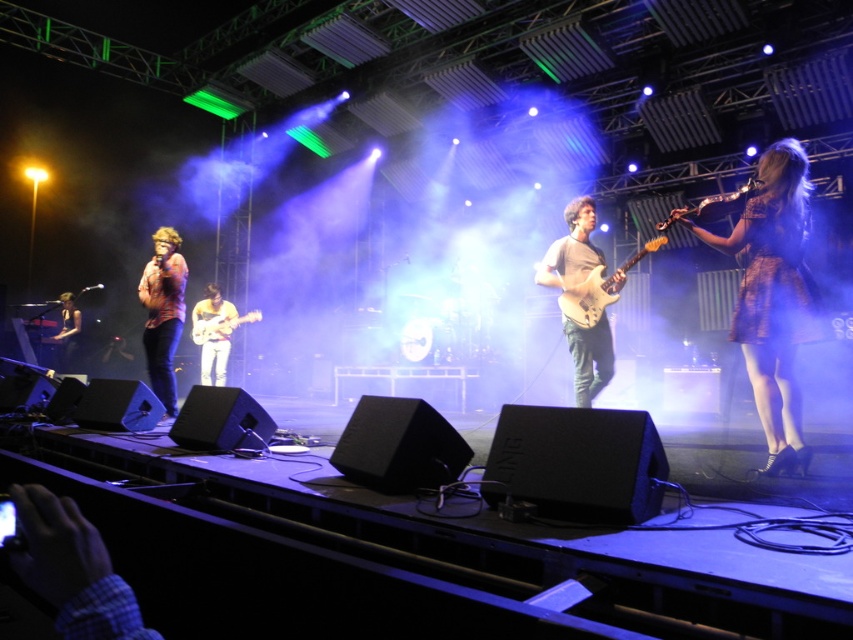
Question: Which point appears closest to the camera in this image?

Choices:
 (A) (714, 204)
 (B) (206, 307)
 (C) (229, 308)
 (D) (795, 164)

Answer: (D)

Question: Can you confirm if matte gray guitar at center is positioned below shiny silver guitar at right?

Choices:
 (A) no
 (B) yes

Answer: (B)

Question: Does patterned fabric dress at right appear on the left side of matte black guitar at left?

Choices:
 (A) no
 (B) yes

Answer: (A)

Question: Is light brown leather guitar at center smaller than matte white electric guitar at center?

Choices:
 (A) no
 (B) yes

Answer: (A)

Question: Which of these objects is positioned farthest from the shiny silver guitar at center?

Choices:
 (A) light brown leather guitar at center
 (B) shiny silver guitar at right
 (C) striped shirt at center
 (D) patterned fabric dress at right

Answer: (D)

Question: Which object appears closest to the camera in this image?

Choices:
 (A) matte gray guitar at center
 (B) shiny silver guitar at center
 (C) striped shirt at center
 (D) matte white electric guitar at center

Answer: (D)